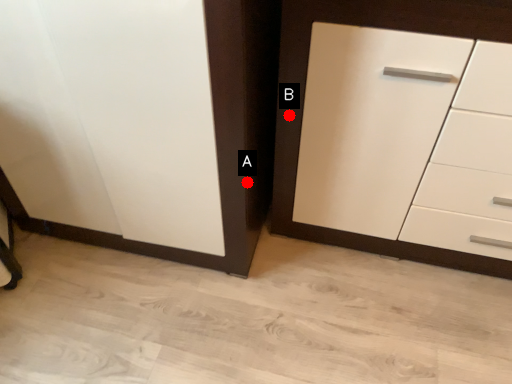
Question: Two points are circled on the image, labeled by A and B beside each circle. Which point is farther to the camera?

Choices:
 (A) A is further
 (B) B is further

Answer: (B)